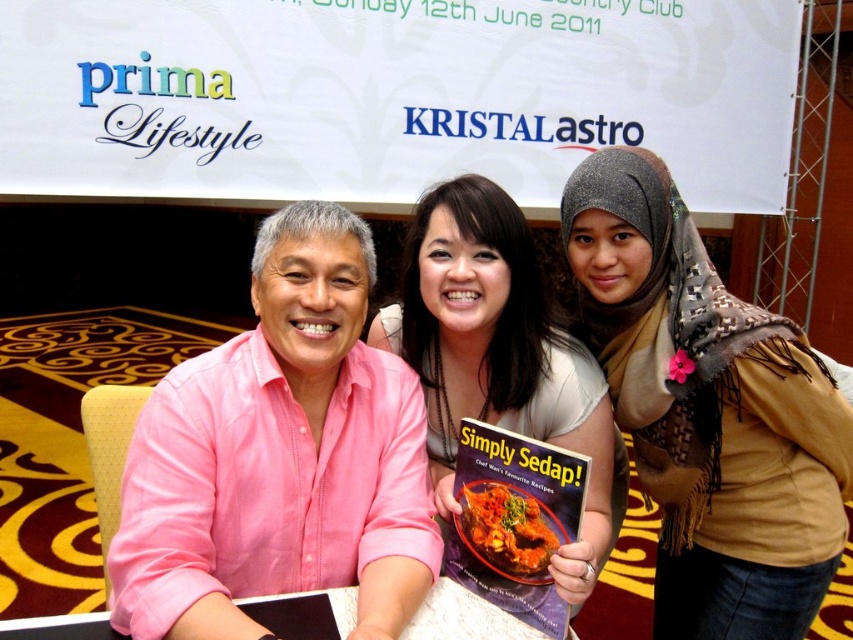
Question: Considering the real-world distances, which object is closest to the white paper at center?

Choices:
 (A) pink linen shirt at left
 (B) tomato sauce dish at center

Answer: (B)

Question: Does pink linen shirt at left come in front of matte white shirt at center?

Choices:
 (A) no
 (B) yes

Answer: (B)

Question: Is matte white shirt at center closer to the viewer compared to hardcover book at center?

Choices:
 (A) yes
 (B) no

Answer: (A)

Question: Which object is farther from the camera taking this photo?

Choices:
 (A) hardcover book at center
 (B) white paper at center
 (C) brown textured scarf at right
 (D) pink linen shirt at left

Answer: (C)

Question: Which of these objects is positioned farthest from the pink linen shirt at left?

Choices:
 (A) hardcover book at center
 (B) matte white shirt at center
 (C) brown textured scarf at right

Answer: (C)

Question: Is pink linen shirt at left further to the viewer compared to brown textured scarf at right?

Choices:
 (A) yes
 (B) no

Answer: (B)